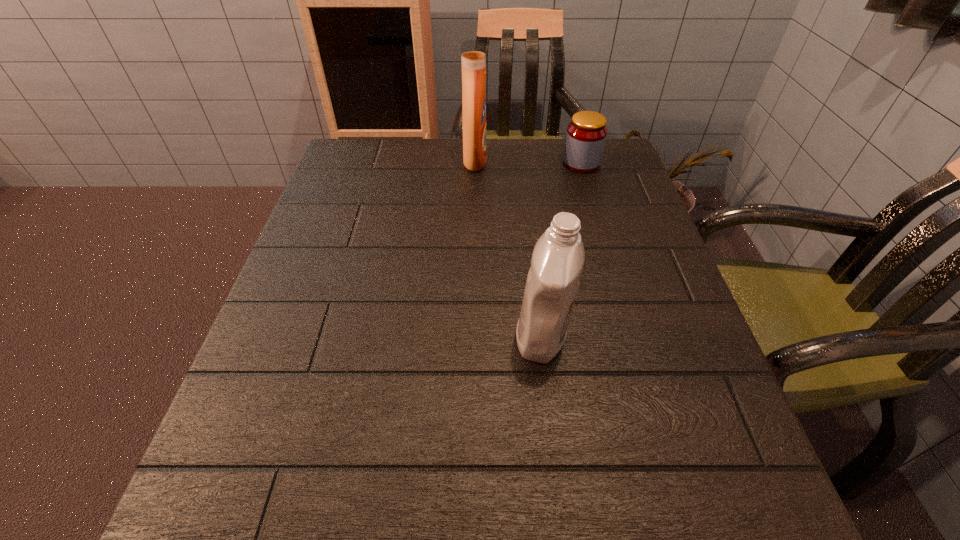
Identify the location of jar at the far edge. (586, 134).

Find the location of a particular element. The height and width of the screenshot is (540, 960). object situated at the right edge is located at coordinates point(586,134).

Locate an element on the screen. The image size is (960, 540). object situated at the far right corner is located at coordinates (586, 134).

I want to click on vacant region at the far edge, so click(514, 159).

Where is `free space at the left edge`? This screenshot has width=960, height=540. free space at the left edge is located at coordinates (234, 454).

At what (x,y) coordinates should I click in order to perform the action: click on vacant region at the right edge of the desktop. Please return your answer as a coordinate pair (x, y). The width and height of the screenshot is (960, 540). Looking at the image, I should click on (649, 255).

You are a GUI agent. You are given a task and a screenshot of the screen. Output one action in this format:
    pyautogui.click(x=<x>, y=<y>)
    Task: Click on the vacant space at the far left corner of the desktop
    The image size is (960, 540).
    Given the screenshot: What is the action you would take?
    pyautogui.click(x=341, y=181)

This screenshot has width=960, height=540. In the image, there is a desktop. In order to click on free space at the near right corner in this screenshot , I will do `click(712, 532)`.

The image size is (960, 540). Identify the location of vacant region between the right detergent and the leftmost object. (508, 248).

In order to click on free area in between the left detergent and the nearest object in this screenshot , I will do `click(508, 248)`.